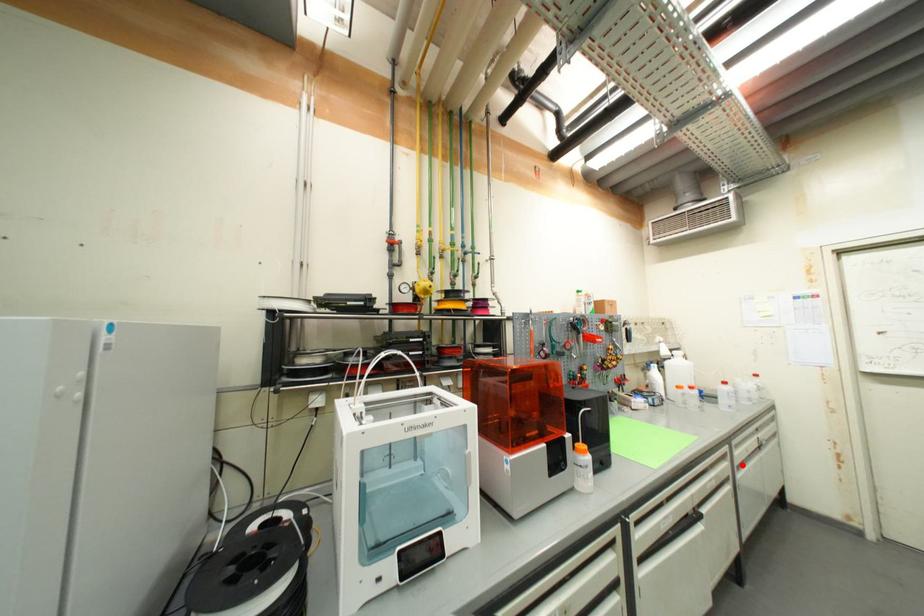
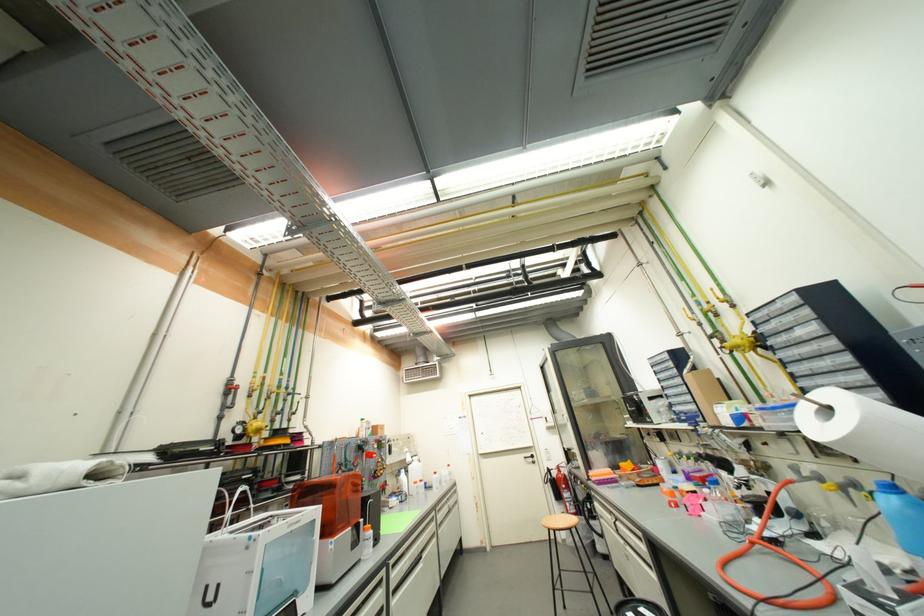
Question: I am providing you with two images of the same scene from different viewpoints. Image1 has a red point marked. In image2, the corresponding 3D location appears at what relative position? Reply with the corresponding letter.

Choices:
 (A) Closer
 (B) Farther

Answer: (B)